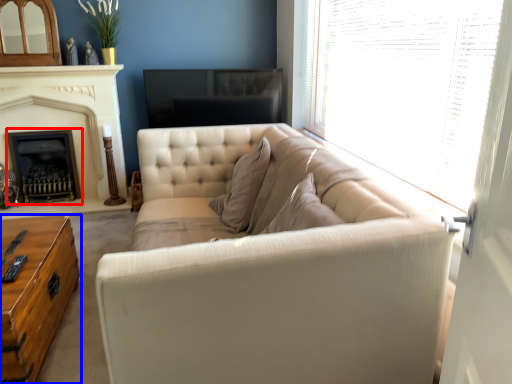
Question: Which of the following is the closest to the observer, fireplace (highlighted by a red box) or table (highlighted by a blue box)?

Choices:
 (A) fireplace
 (B) table

Answer: (B)